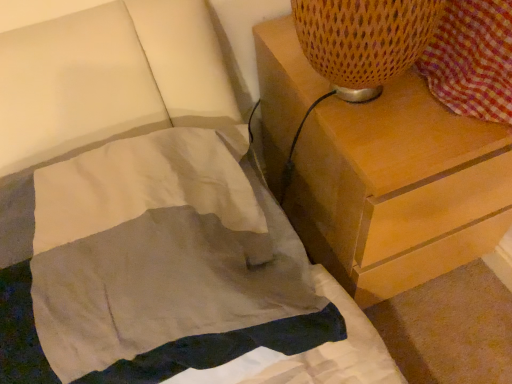
From the picture: What is the approximate height of wooden chest of drawers at upper right?

The height of wooden chest of drawers at upper right is 54.97 centimeters.

Find the location of a particular element. This screenshot has height=384, width=512. wooden chest of drawers at upper right is located at coordinates (398, 189).

The height and width of the screenshot is (384, 512). What do you see at coordinates (398, 189) in the screenshot?
I see `wooden chest of drawers at upper right` at bounding box center [398, 189].

This screenshot has width=512, height=384. In order to click on light gray cotton blanket at lower left in this screenshot , I will do `click(151, 265)`.

Measure the distance between point (265, 227) and camera.

Point (265, 227) is 64.10 centimeters from camera.

The image size is (512, 384). What do you see at coordinates (151, 265) in the screenshot? I see `light gray cotton blanket at lower left` at bounding box center [151, 265].

Identify the location of wooden chest of drawers at upper right. (398, 189).

Is wooden chest of drawers at upper right at the right side of light gray cotton blanket at lower left?

Indeed, wooden chest of drawers at upper right is positioned on the right side of light gray cotton blanket at lower left.

Looking at this image, which object is further away from the camera taking this photo, wooden chest of drawers at upper right or light gray cotton blanket at lower left?

wooden chest of drawers at upper right.

Is point (297, 231) in front of point (136, 216)?

No, (297, 231) is further to viewer.

From the image's perspective, is wooden chest of drawers at upper right beneath light gray cotton blanket at lower left?

No, from the image's perspective, wooden chest of drawers at upper right is not beneath light gray cotton blanket at lower left.

From a real-world perspective, does wooden chest of drawers at upper right stand above light gray cotton blanket at lower left?

No, from a real-world perspective, wooden chest of drawers at upper right is not over light gray cotton blanket at lower left

Considering the relative sizes of wooden chest of drawers at upper right and light gray cotton blanket at lower left in the image provided, is wooden chest of drawers at upper right thinner than light gray cotton blanket at lower left?

In fact, wooden chest of drawers at upper right might be wider than light gray cotton blanket at lower left.

Can you confirm if wooden chest of drawers at upper right is taller than light gray cotton blanket at lower left?

Yes.

Between wooden chest of drawers at upper right and light gray cotton blanket at lower left, which one has smaller size?

With smaller size is light gray cotton blanket at lower left.

Do you think wooden chest of drawers at upper right is within light gray cotton blanket at lower left, or outside of it?

wooden chest of drawers at upper right cannot be found inside light gray cotton blanket at lower left.

Is wooden chest of drawers at upper right far away from light gray cotton blanket at lower left?

No, wooden chest of drawers at upper right is not far from light gray cotton blanket at lower left.

Is wooden chest of drawers at upper right looking in the opposite direction of light gray cotton blanket at lower left?

No, wooden chest of drawers at upper right is not facing the opposite direction of light gray cotton blanket at lower left.

Can you tell me how much wooden chest of drawers at upper right and light gray cotton blanket at lower left differ in facing direction?

The facing directions of wooden chest of drawers at upper right and light gray cotton blanket at lower left are 2.27 degrees apart.

How distant is wooden chest of drawers at upper right from light gray cotton blanket at lower left?

A distance of 11.81 inches exists between wooden chest of drawers at upper right and light gray cotton blanket at lower left.

Where is `the chest of drawers lying above the light gray cotton blanket at lower left (from the image's perspective)`? The width and height of the screenshot is (512, 384). the chest of drawers lying above the light gray cotton blanket at lower left (from the image's perspective) is located at coordinates (398, 189).

Based on their positions, is light gray cotton blanket at lower left located to the left or right of wooden chest of drawers at upper right?

Clearly, light gray cotton blanket at lower left is on the left of wooden chest of drawers at upper right in the image.

Is light gray cotton blanket at lower left further to the viewer compared to wooden chest of drawers at upper right?

No, it is not.

Is point (133, 254) farther from camera compared to point (509, 214)?

No, it is in front of (509, 214).

From the image's perspective, which is below, light gray cotton blanket at lower left or wooden chest of drawers at upper right?

light gray cotton blanket at lower left.

From a real-world perspective, is light gray cotton blanket at lower left physically located above or below wooden chest of drawers at upper right?

light gray cotton blanket at lower left is above wooden chest of drawers at upper right.

Considering the sizes of objects light gray cotton blanket at lower left and wooden chest of drawers at upper right in the image provided, who is wider, light gray cotton blanket at lower left or wooden chest of drawers at upper right?

wooden chest of drawers at upper right.

Considering the relative sizes of light gray cotton blanket at lower left and wooden chest of drawers at upper right in the image provided, is light gray cotton blanket at lower left taller than wooden chest of drawers at upper right?

No.

Which of these two, light gray cotton blanket at lower left or wooden chest of drawers at upper right, is bigger?

With larger size is wooden chest of drawers at upper right.

Would you say wooden chest of drawers at upper right is part of light gray cotton blanket at lower left's contents?

No, wooden chest of drawers at upper right is located outside of light gray cotton blanket at lower left.

Does light gray cotton blanket at lower left touch wooden chest of drawers at upper right?

They are not placed beside each other.

Is light gray cotton blanket at lower left facing towards wooden chest of drawers at upper right?

No, light gray cotton blanket at lower left is not oriented towards wooden chest of drawers at upper right.

How many degrees apart are the facing directions of light gray cotton blanket at lower left and wooden chest of drawers at upper right?

light gray cotton blanket at lower left and wooden chest of drawers at upper right are facing 2.27 degrees away from each other.

Could you measure the distance between light gray cotton blanket at lower left and wooden chest of drawers at upper right?

light gray cotton blanket at lower left is 11.81 inches away from wooden chest of drawers at upper right.

Find the location of `chest of drawers that appears on the right of light gray cotton blanket at lower left`. chest of drawers that appears on the right of light gray cotton blanket at lower left is located at coordinates (398, 189).

The image size is (512, 384). I want to click on chest of drawers that is on the right side of light gray cotton blanket at lower left, so click(x=398, y=189).

The width and height of the screenshot is (512, 384). I want to click on blanket located in front of the wooden chest of drawers at upper right, so pyautogui.click(x=151, y=265).